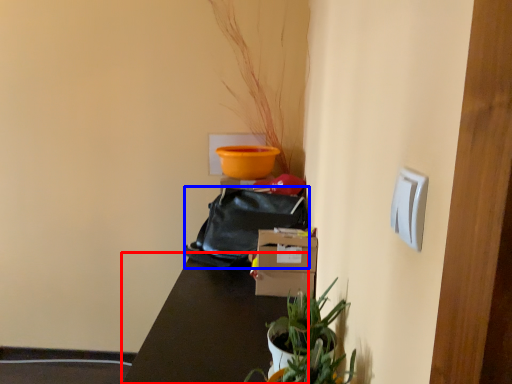
Question: Which point is further to the camera, table (highlighted by a red box) or bag (highlighted by a blue box)?

Choices:
 (A) table
 (B) bag

Answer: (B)